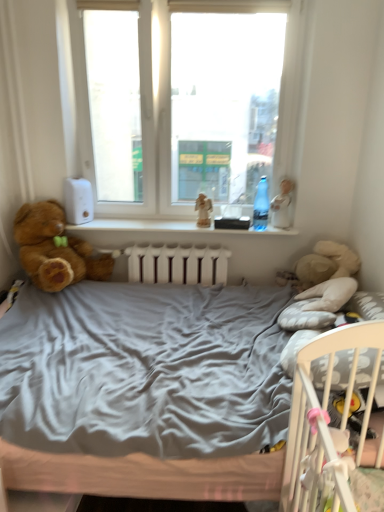
Locate an element on the screen. white porcelain doll at upper right is located at coordinates (282, 204).

Where is `transparent plastic bottle at window`? This screenshot has height=512, width=384. transparent plastic bottle at window is located at coordinates coord(261,206).

Find the location of a particular element. This screenshot has width=384, height=512. wooden angel at center is located at coordinates (203, 210).

Is transparent plastic bottle at window oriented towards wooden angel at center?

No, transparent plastic bottle at window does not turn towards wooden angel at center.

From a real-world perspective, is transparent plastic bottle at window below wooden angel at center?

No, from a real-world perspective, transparent plastic bottle at window is not under wooden angel at center.

Is point (267, 206) behind point (207, 219)?

No, (267, 206) is in front of (207, 219).

Is transparent plastic bottle at window closer to the viewer compared to wooden angel at center?

Yes, transparent plastic bottle at window is in front of wooden angel at center.

Is wooden angel at center inside the boundaries of transparent plastic bottle at window, or outside?

wooden angel at center cannot be found inside transparent plastic bottle at window.

From the image's perspective, between wooden angel at center and transparent plastic bottle at window, who is located below?

wooden angel at center, from the image's perspective.

Considering the positions of points (204, 223) and (258, 224), is point (204, 223) farther from camera compared to point (258, 224)?

That is True.

Can you see brown plush teddy bear at left touching wooden angel at center?

No, brown plush teddy bear at left is not next to wooden angel at center.

From a real-world perspective, does brown plush teddy bear at left sit lower than wooden angel at center?

Yes.

Is point (44, 270) closer or farther from the camera than point (195, 205)?

Point (44, 270).

Could you tell me if brown plush teddy bear at left is turned towards wooden angel at center?

No, brown plush teddy bear at left is not facing towards wooden angel at center.

From the image's perspective, is wooden angel at center over brown plush teddy bear at left?

Yes, from the image's perspective, wooden angel at center is above brown plush teddy bear at left.

Is wooden angel at center next to brown plush teddy bear at left and touching it?

No, wooden angel at center is not in contact with brown plush teddy bear at left.

Is brown plush teddy bear at left at the back of wooden angel at center?

wooden angel at center is not turned away from brown plush teddy bear at left.

Locate an element on the screen. The image size is (384, 512). teddy bear on the left of wooden angel at center is located at coordinates (55, 249).

In the scene shown: Who is bigger, brown plush teddy bear at left or white porcelain doll at upper right?

With larger size is brown plush teddy bear at left.

Relative to white porcelain doll at upper right, is brown plush teddy bear at left in front or behind?

In the image, brown plush teddy bear at left appears in front of white porcelain doll at upper right.

Who is bigger, transparent glass window at center or white plastic window sill at center?

With larger size is transparent glass window at center.

How much distance is there between transparent glass window at center and white plastic window sill at center?

transparent glass window at center is 21.65 inches from white plastic window sill at center.

How many degrees apart are the facing directions of transparent glass window at center and white plastic window sill at center?

They differ by 0.000512 degrees in their facing directions.

Considering the relative sizes of transparent glass window at center and white plastic window sill at center in the image provided, is transparent glass window at center wider than white plastic window sill at center?

Incorrect, the width of transparent glass window at center does not surpass that of white plastic window sill at center.

Looking at this image, is transparent plastic bottle at window in front of white plastic window sill at center?

Yes, transparent plastic bottle at window is closer to the camera.

Based on their sizes in the image, would you say transparent plastic bottle at window is bigger or smaller than white plastic window sill at center?

Clearly, transparent plastic bottle at window is smaller in size than white plastic window sill at center.

Considering the relative positions of transparent plastic bottle at window and white plastic window sill at center in the image provided, is transparent plastic bottle at window to the left or to the right of white plastic window sill at center?

In the image, transparent plastic bottle at window appears on the right side of white plastic window sill at center.

From the image's perspective, does transparent plastic bottle at window appear higher than white plastic window sill at center?

Yes, from the image's perspective, transparent plastic bottle at window is over white plastic window sill at center.

This screenshot has height=512, width=384. Identify the location of figurine that appears on the left of transparent plastic bottle at window. (203, 210).

Image resolution: width=384 pixels, height=512 pixels. Identify the location of bottle to the right of wooden angel at center. (261, 206).

Looking at this image, looking at the image, which one is located further to transparent plastic bottle at window, brown plush teddy bear at left or transparent glass window at center?

brown plush teddy bear at left.

Which object lies nearer to the anchor point wooden angel at center, white porcelain doll at upper right or white plastic window sill at center?

white plastic window sill at center is positioned closer to the anchor wooden angel at center.

When comparing their distances from transparent glass window at center, does transparent plastic bottle at window or white porcelain doll at upper right seem further?

Based on the image, white porcelain doll at upper right appears to be further to transparent glass window at center.

When comparing their distances from brown plush teddy bear at left, does transparent glass window at center or wooden angel at center seem further?

Based on the image, wooden angel at center appears to be further to brown plush teddy bear at left.

Looking at the image, which one is located closer to white porcelain doll at upper right, transparent plastic bottle at window or transparent glass window at center?

transparent plastic bottle at window is positioned closer to the anchor white porcelain doll at upper right.

Based on their spatial positions, is white porcelain doll at upper right or transparent plastic bottle at window further from brown plush teddy bear at left?

white porcelain doll at upper right is positioned further to the anchor brown plush teddy bear at left.

Estimate the real-world distances between objects in this image. Which object is closer to brown plush teddy bear at left, transparent glass window at center or transparent plastic bottle at window?

transparent glass window at center lies closer to brown plush teddy bear at left than the other object.

Looking at the image, which one is located further to white porcelain doll at upper right, white plastic window sill at center or brown plush teddy bear at left?

Among the two, brown plush teddy bear at left is located further to white porcelain doll at upper right.

The width and height of the screenshot is (384, 512). I want to click on window between brown plush teddy bear at left and transparent plastic bottle at window from left to right, so click(187, 102).

The image size is (384, 512). I want to click on window sill situated between brown plush teddy bear at left and white porcelain doll at upper right from left to right, so click(168, 228).

Locate an element on the screen. figurine between transparent glass window at center and white plastic window sill at center in the vertical direction is located at coordinates (203, 210).

I want to click on window sill between transparent glass window at center and brown plush teddy bear at left in the vertical direction, so click(x=168, y=228).